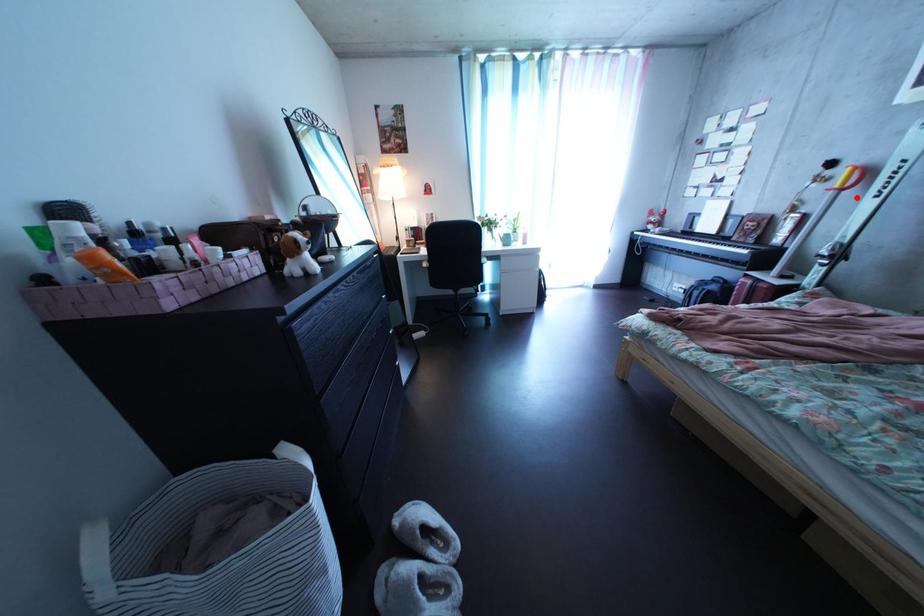
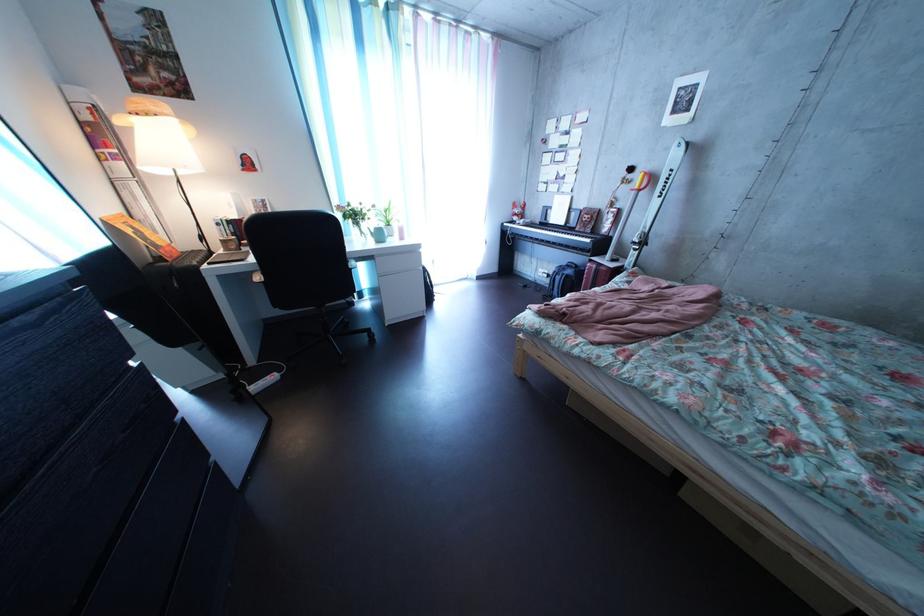
Find the pixel in the second image that matches the highlighted location in the first image.

(653, 199)